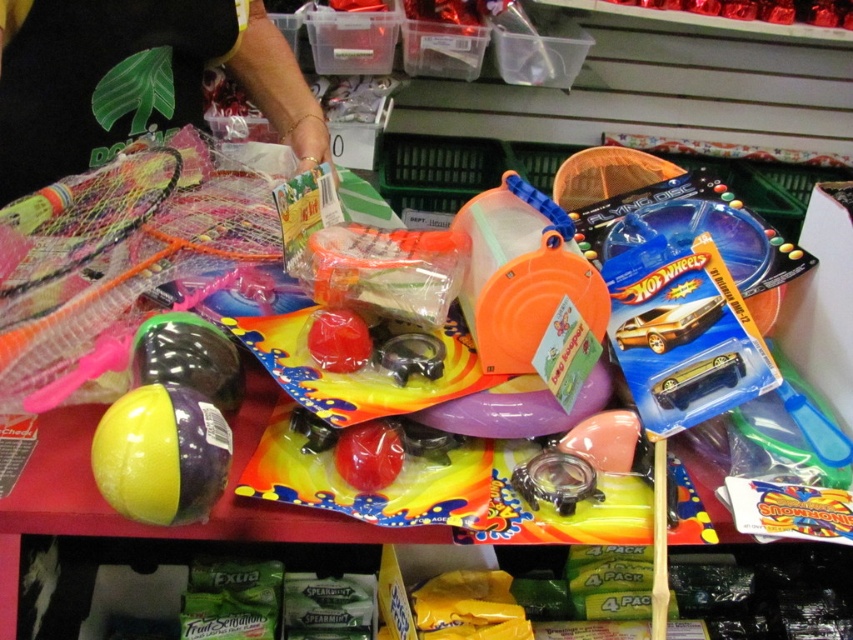
You are a customer in the store looking at the black mesh netting at left and the yellow rubber ball at lower left. Which item is closer to you?

The black mesh netting at left is closer to you because it is further to the viewer than the yellow rubber ball at lower left.

You are a store employee organizing items on the red shelf. You need to place a new item between the black mesh netting at left and the yellow rubber ball at lower left. Can you fit it there?

The black mesh netting at left might be wider than the yellow rubber ball at lower left, so there may not be enough space to fit the new item between them.

You are a store employee organizing items on a shelf. You need to place a new item that requires 10 cm of vertical space. The black mesh netting at left and the yellow rubber ball at lower left are already on the shelf. Can you determine which object allows more vertical space for the new item?

The black mesh netting at left has a greater height compared to the yellow rubber ball at lower left, so it provides more vertical space. Therefore, placing the new item next to the black mesh netting at left would allow sufficient vertical space for the new item.